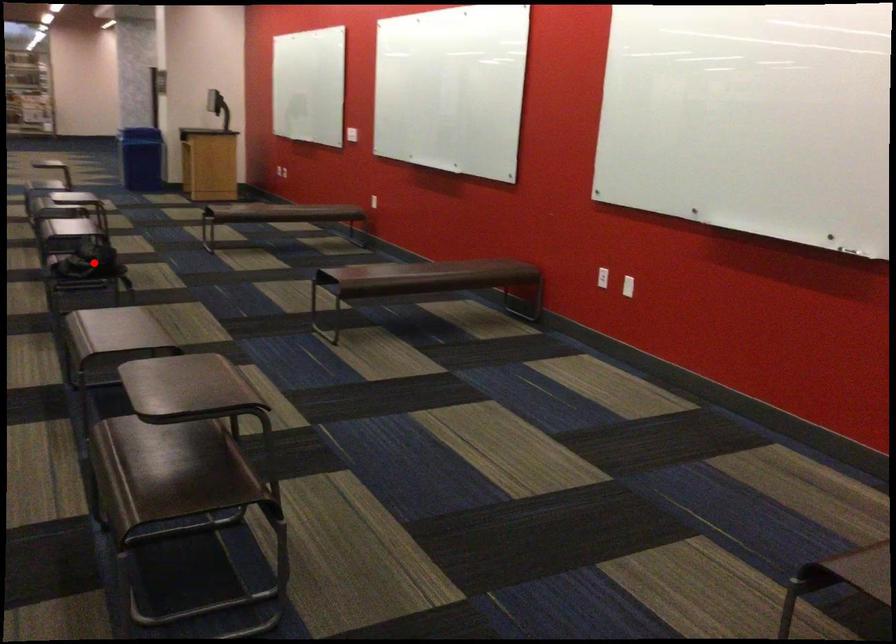
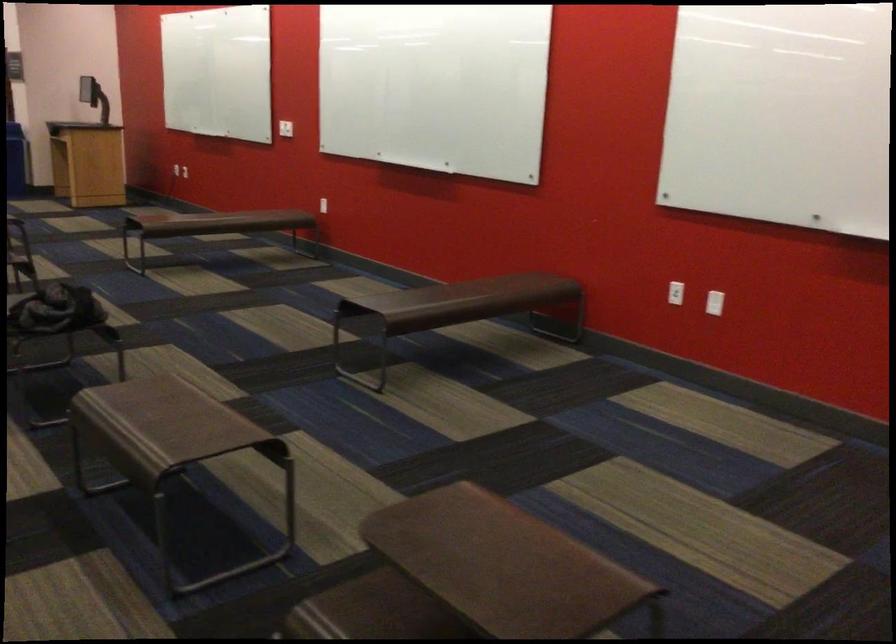
In the second image, find the point that corresponds to the highlighted location in the first image.

(56, 310)